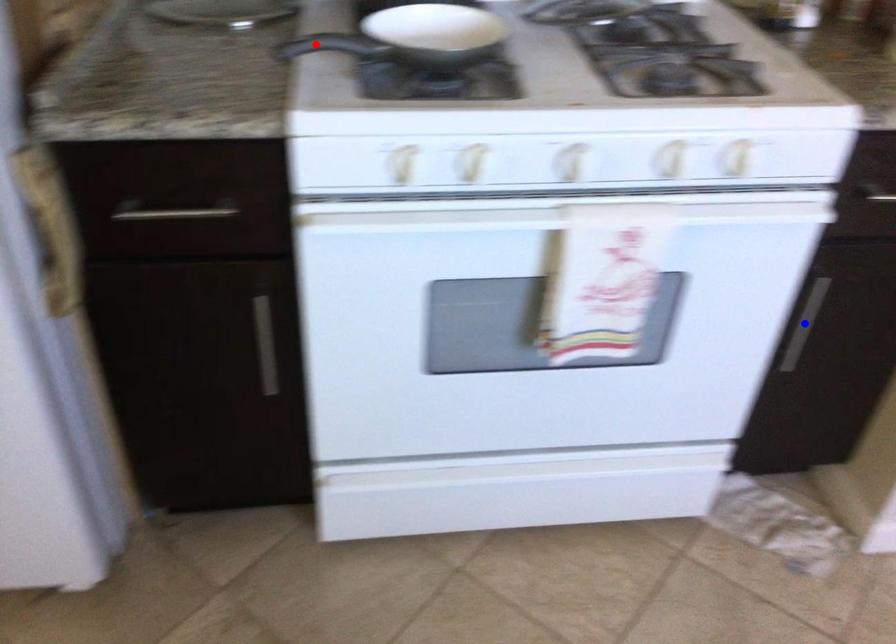
Question: Which of the two points in the image is closer to the camera?

Choices:
 (A) Blue point is closer.
 (B) Red point is closer.

Answer: (B)